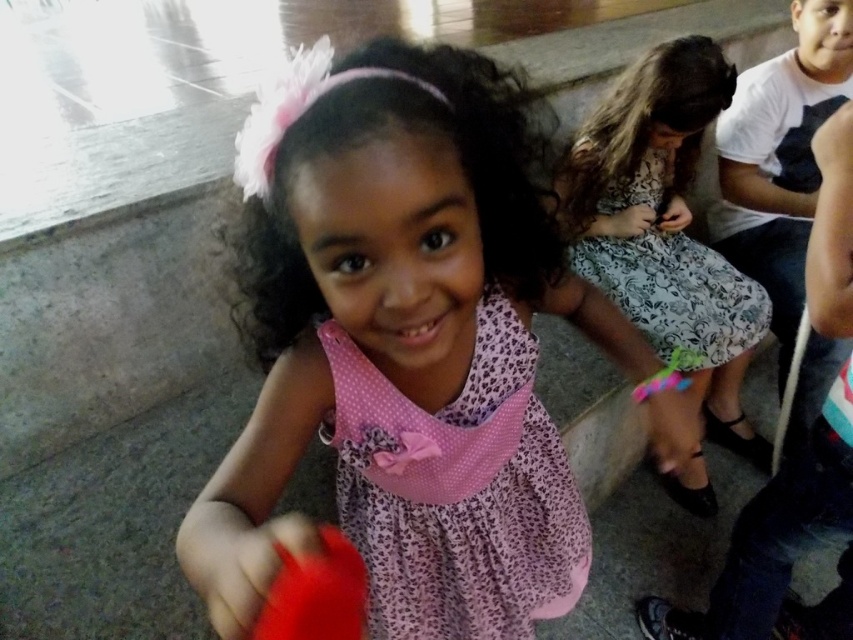
Question: Which point is farther to the camera?

Choices:
 (A) pink plastic toy at lower right
 (B) floral-patterned dress at center
 (C) floral-patterned fabric dress at center

Answer: (C)

Question: Observing the image, what is the correct spatial positioning of pink dotted dress at center in reference to pink plastic toy at lower right?

Choices:
 (A) left
 (B) right

Answer: (A)

Question: Is floral-patterned dress at center below pink plastic toy at lower right?

Choices:
 (A) no
 (B) yes

Answer: (A)

Question: Which point is farther to the camera?

Choices:
 (A) (660, 380)
 (B) (322, 556)

Answer: (A)

Question: Which of these objects is positioned farthest from the rubberized plastic toy at lower left?

Choices:
 (A) floral-patterned dress at center
 (B) pink dotted dress at center
 (C) pink dotted fabric dress at center
 (D) floral-patterned fabric dress at center

Answer: (D)

Question: Can you confirm if pink dotted dress at center is wider than floral-patterned dress at center?

Choices:
 (A) yes
 (B) no

Answer: (B)